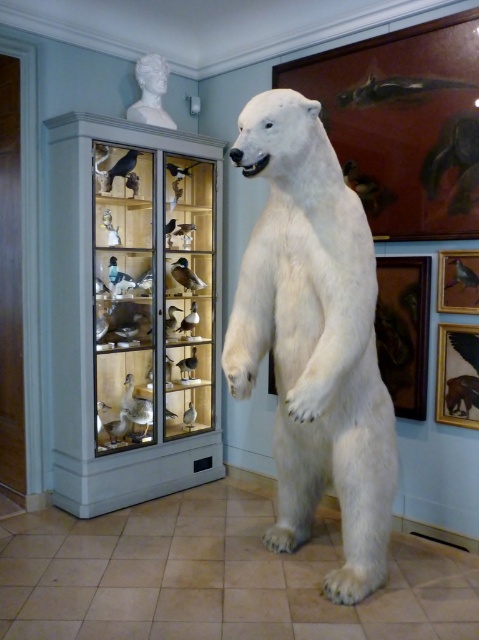
Who is shorter, white fur polar bear at center or white marble bust at upper center?

white marble bust at upper center is shorter.

Does white fur polar bear at center appear on the right side of white marble bust at upper center?

Indeed, white fur polar bear at center is positioned on the right side of white marble bust at upper center.

Describe the element at coordinates (314, 339) in the screenshot. The image size is (479, 640). I see `white fur polar bear at center` at that location.

Where is `white fur polar bear at center`? white fur polar bear at center is located at coordinates (314, 339).